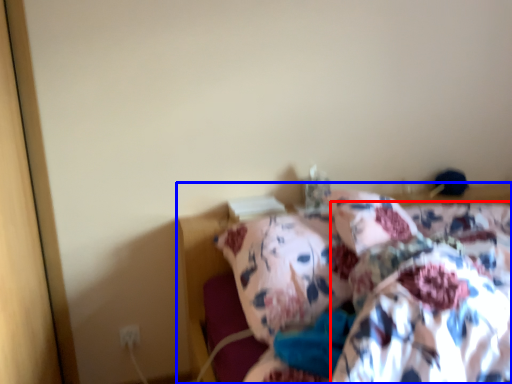
Question: Which object is closer to the camera taking this photo, blanket (highlighted by a red box) or bed (highlighted by a blue box)?

Choices:
 (A) blanket
 (B) bed

Answer: (B)